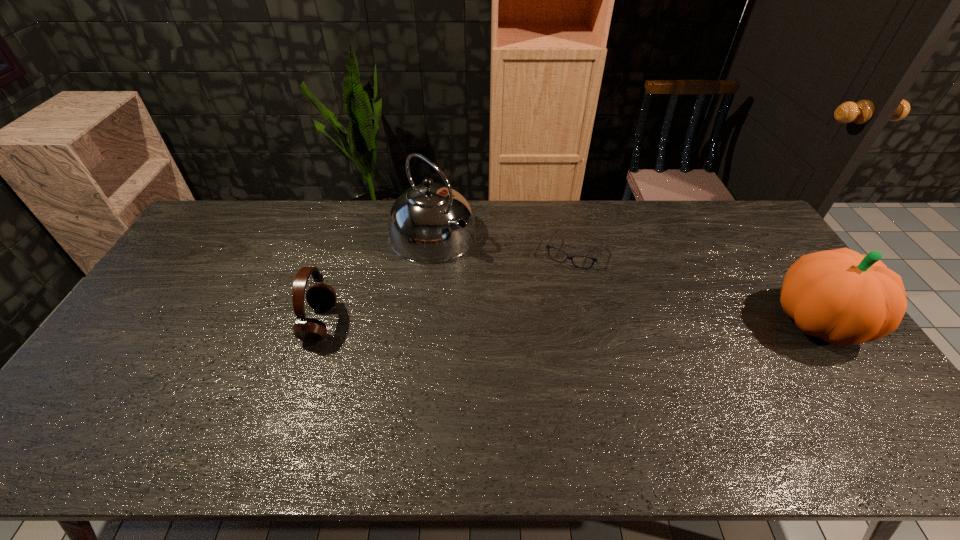
Find the location of a particular element. The height and width of the screenshot is (540, 960). free space on the desktop that is between the leftmost object and the pumpkin and is positioned on the front-facing side of the second object from right to left is located at coordinates (542, 322).

Where is `free space on the desktop that is between the headset and the pumpkin and is positioned from the spout of the kettle`? This screenshot has height=540, width=960. free space on the desktop that is between the headset and the pumpkin and is positioned from the spout of the kettle is located at coordinates (543, 322).